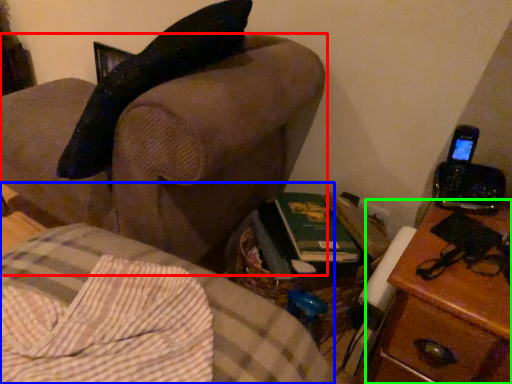
Question: Based on their relative distances, which object is farther from furniture (highlighted by a red box)? Choose from furniture (highlighted by a blue box) and nightstand (highlighted by a green box).

Choices:
 (A) furniture
 (B) nightstand

Answer: (B)